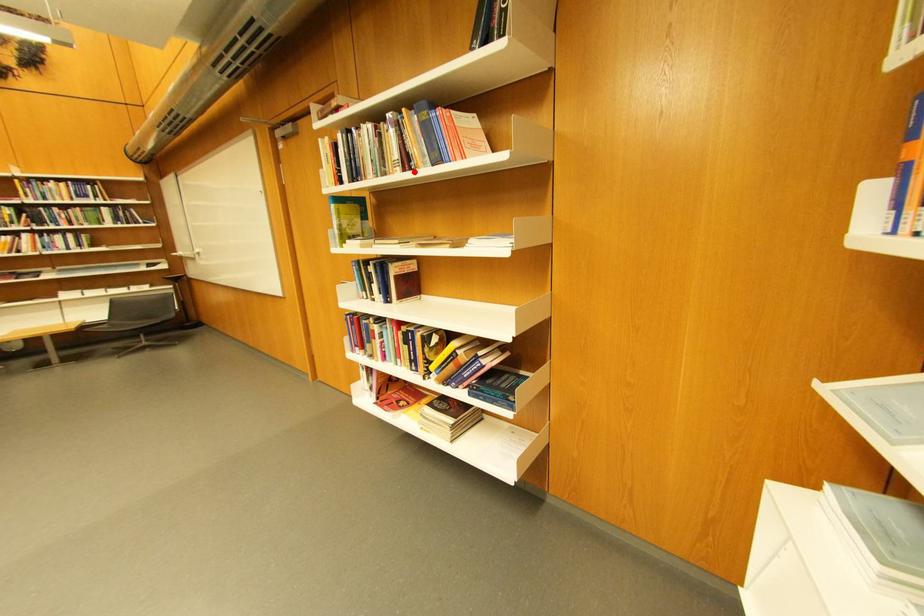
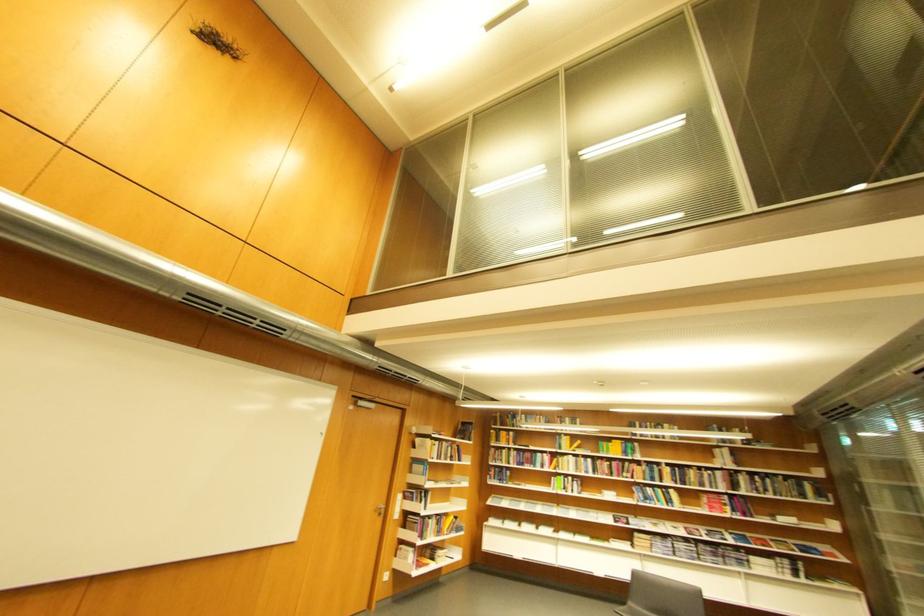
Question: A red point is marked in image1. In image2, is the corresponding 3D point closer to the camera or farther? Reply with the corresponding letter.

Choices:
 (A) The corresponding 3D point is closer.
 (B) The corresponding 3D point is farther.

Answer: (B)